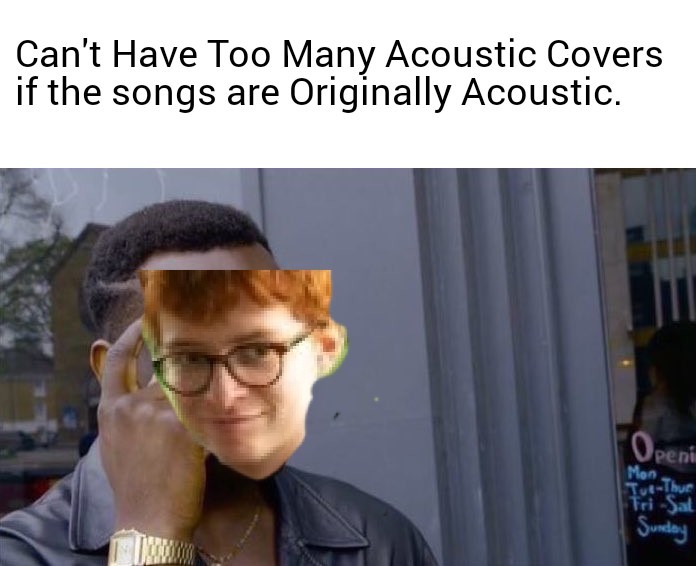
You are a GUI agent. You are given a task and a screenshot of the screen. Output one action in this format:
    pyautogui.click(x=<x>, y=<y>)
    Task: Click on the window
    
    Given the screenshot: What is the action you would take?
    pyautogui.click(x=651, y=274)